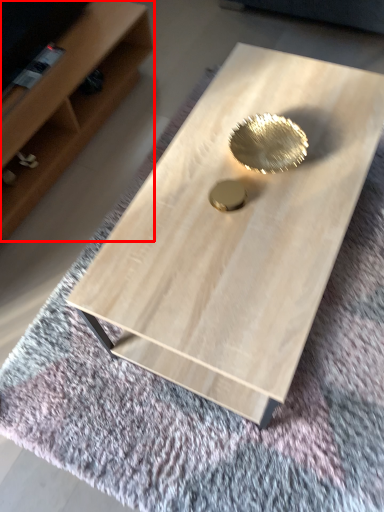
Question: Considering the relative positions of shelf (annotated by the red box) and coffee table in the image provided, where is shelf (annotated by the red box) located with respect to the staircase?

Choices:
 (A) left
 (B) right

Answer: (A)